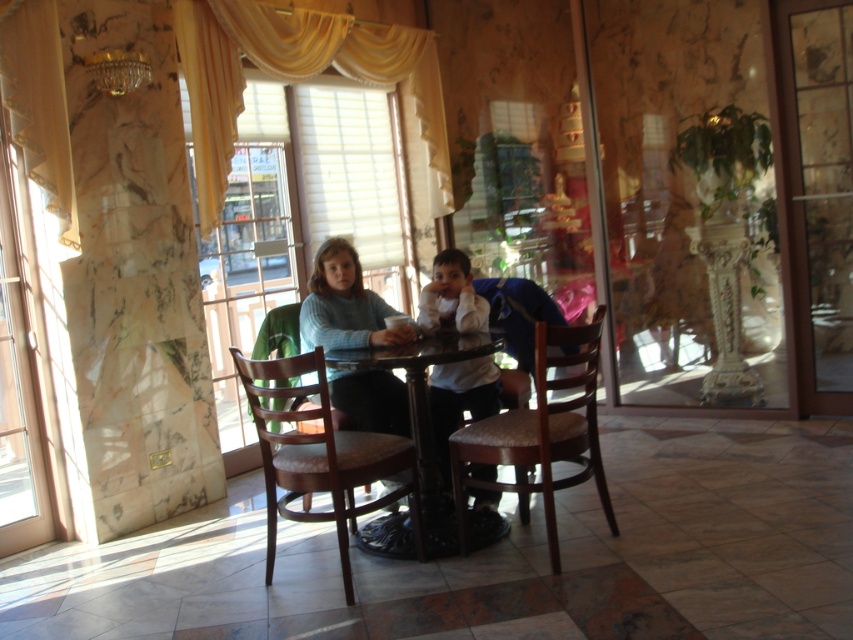
Who is higher up, wooden chair at center or wooden polished table at center?

wooden chair at center is above.

Can you confirm if wooden chair at center is shorter than wooden polished table at center?

No, wooden chair at center is not shorter than wooden polished table at center.

Where is `wooden chair at center`? wooden chair at center is located at coordinates (540, 433).

Does wooden chair at center appear on the right side of matte blue sweater at center?

Correct, you'll find wooden chair at center to the right of matte blue sweater at center.

Is wooden chair at center closer to the viewer compared to matte blue sweater at center?

Yes.

What do you see at coordinates (540, 433) in the screenshot? I see `wooden chair at center` at bounding box center [540, 433].

The height and width of the screenshot is (640, 853). Find the location of `wooden chair at center`. wooden chair at center is located at coordinates (540, 433).

Can you confirm if brown leather chair at center is taller than wooden chair at center?

No, brown leather chair at center is not taller than wooden chair at center.

Between brown leather chair at center and wooden chair at center, which one has less height?

Standing shorter between the two is brown leather chair at center.

Who is more forward, (265, 563) or (521, 436)?

Point (521, 436) is in front.

Locate an element on the screen. The height and width of the screenshot is (640, 853). brown leather chair at center is located at coordinates (320, 456).